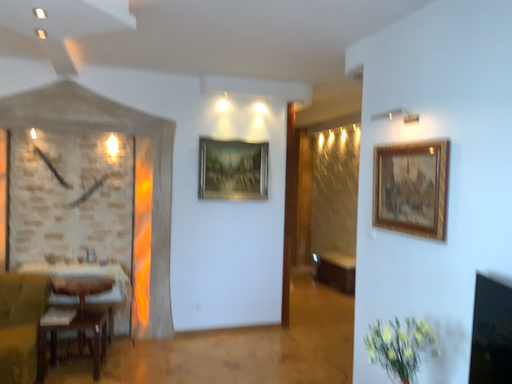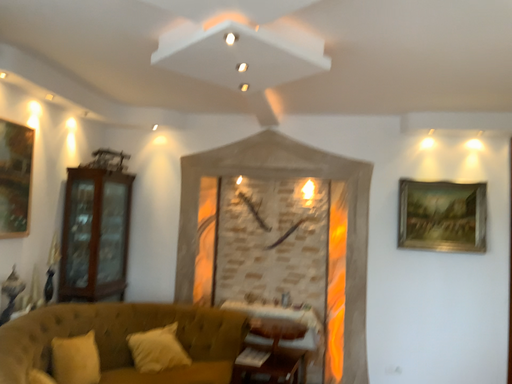
Question: How did the camera likely rotate when shooting the video?

Choices:
 (A) rotated right
 (B) rotated left

Answer: (B)